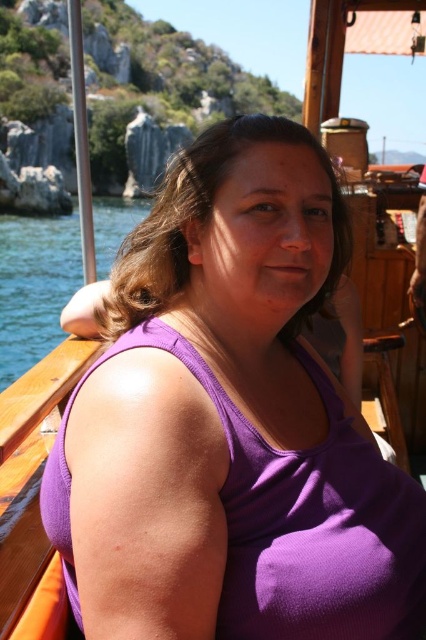
Is point (100, 582) positioned before point (106, 220)?

Yes.

Looking at this image, can you confirm if purple fabric tank top at center is smaller than blue water at left?

Correct, purple fabric tank top at center occupies less space than blue water at left.

Image resolution: width=426 pixels, height=640 pixels. I want to click on purple fabric tank top at center, so click(x=230, y=422).

Find the location of a particular element. The height and width of the screenshot is (640, 426). purple fabric tank top at center is located at coordinates (230, 422).